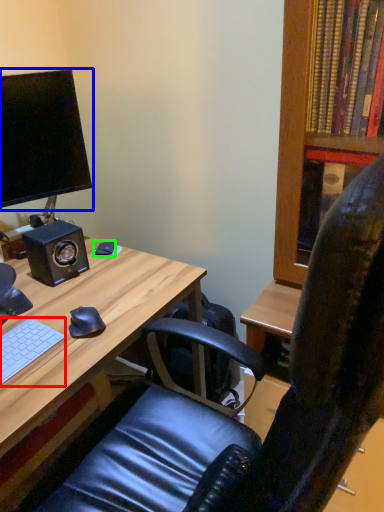
Question: Based on their relative distances, which object is farther from computer keyboard (highlighted by a red box)? Choose from computer monitor (highlighted by a blue box) and mouse (highlighted by a green box).

Choices:
 (A) computer monitor
 (B) mouse

Answer: (A)